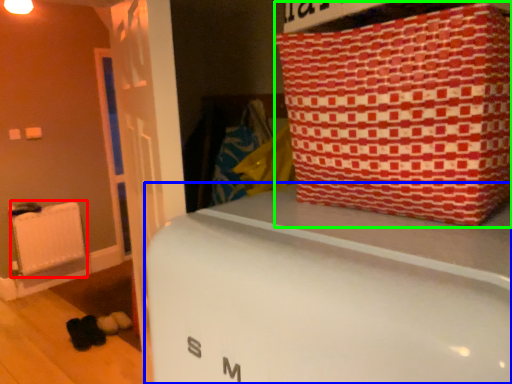
Question: Which object is the closest to the radiator (highlighted by a red box)? Choose among these: furniture (highlighted by a blue box) or package (highlighted by a green box).

Choices:
 (A) furniture
 (B) package

Answer: (A)